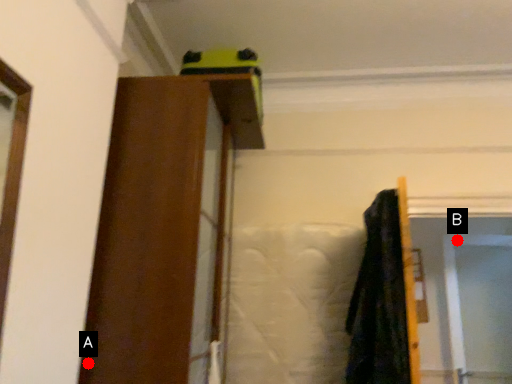
Question: Two points are circled on the image, labeled by A and B beside each circle. Which point appears closest to the camera in this image?

Choices:
 (A) A is closer
 (B) B is closer

Answer: (A)